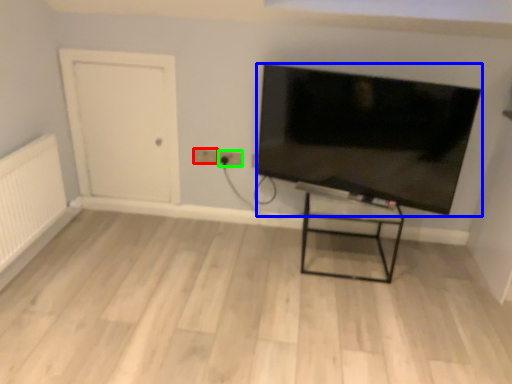
Question: Considering the real-world distances, which object is farthest from electric outlet (highlighted by a red box)? television (highlighted by a blue box) or electric outlet (highlighted by a green box)?

Choices:
 (A) television
 (B) electric outlet

Answer: (A)